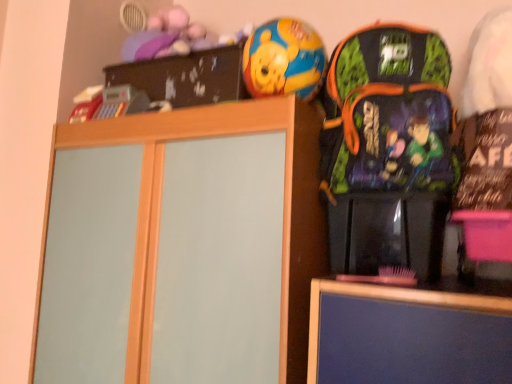
Question: Based on their sizes in the image, would you say multicolored fabric backpack at right is bigger or smaller than shiny plastic ball at upper center?

Choices:
 (A) small
 (B) big

Answer: (B)

Question: Choose the correct answer: Is multicolored fabric backpack at right inside shiny plastic ball at upper center or outside it?

Choices:
 (A) outside
 (B) inside

Answer: (A)

Question: Based on their relative distances, which object is farther from the multicolored fabric backpack at right?

Choices:
 (A) shiny plastic ball at upper center
 (B) wooden cabinet at center

Answer: (B)

Question: Based on their relative distances, which object is farther from the shiny plastic ball at upper center?

Choices:
 (A) wooden cabinet at center
 (B) multicolored fabric backpack at right

Answer: (A)